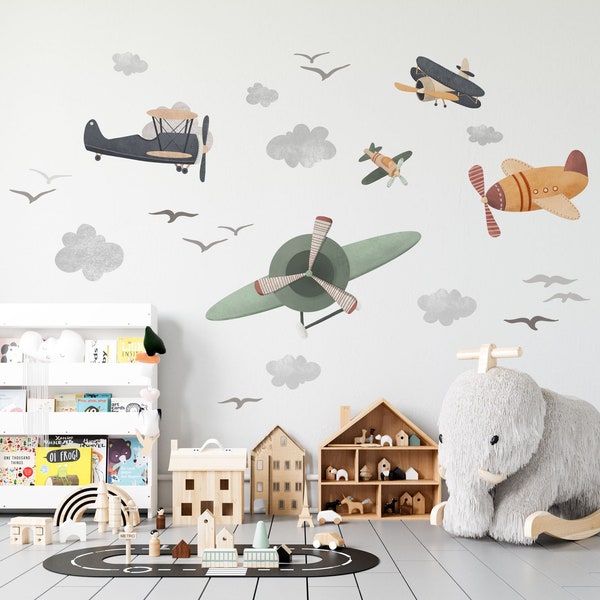
This screenshot has width=600, height=600. What are the coordinates of `toy eiffel tower` in the screenshot? It's located at (x=304, y=511).